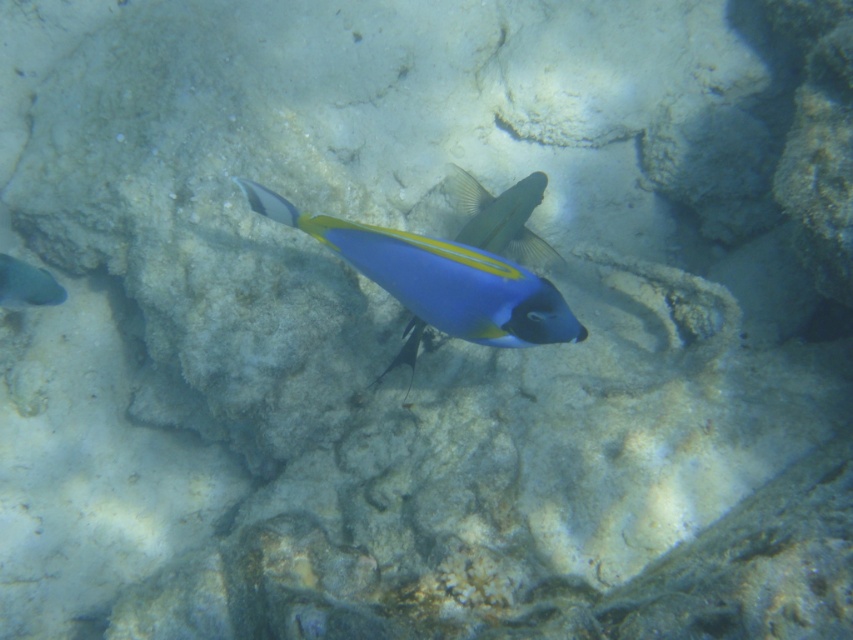
Question: Does shiny blue fish at center have a larger size compared to blue glossy fish at center?

Choices:
 (A) yes
 (B) no

Answer: (B)

Question: Does shiny blue fish at center lie in front of matte gray fish at left?

Choices:
 (A) no
 (B) yes

Answer: (B)

Question: Among these points, which one is nearest to the camera?

Choices:
 (A) (247, 198)
 (B) (469, 205)
 (C) (59, 296)

Answer: (A)

Question: Which point is farther to the camera?

Choices:
 (A) shiny blue fish at center
 (B) blue glossy fish at center
 (C) matte gray fish at left

Answer: (B)

Question: Does shiny blue fish at center appear on the left side of blue glossy fish at center?

Choices:
 (A) no
 (B) yes

Answer: (B)

Question: Which of these objects is positioned farthest from the shiny blue fish at center?

Choices:
 (A) matte gray fish at left
 (B) blue glossy fish at center

Answer: (B)